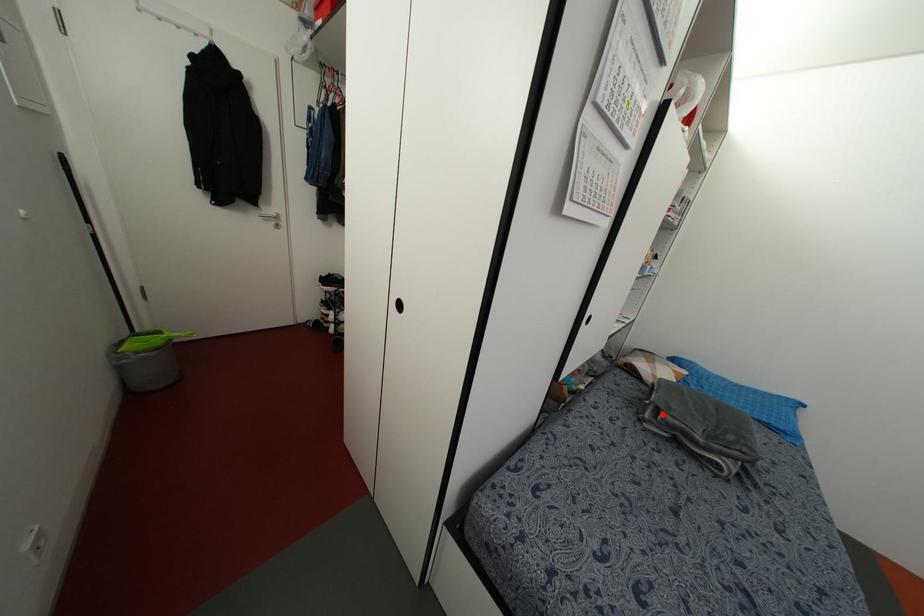
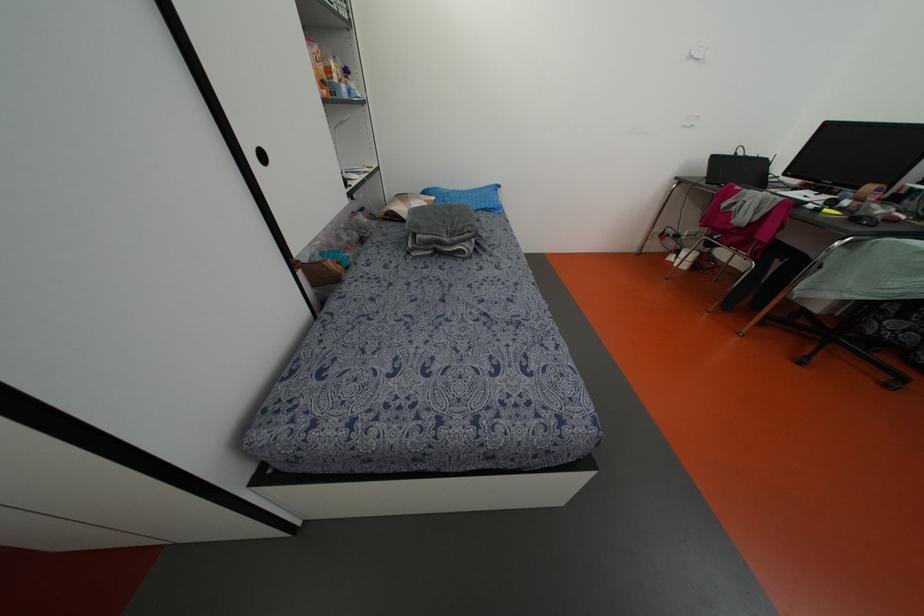
Find the pixel in the second image that matches the highlighted location in the first image.

(418, 236)